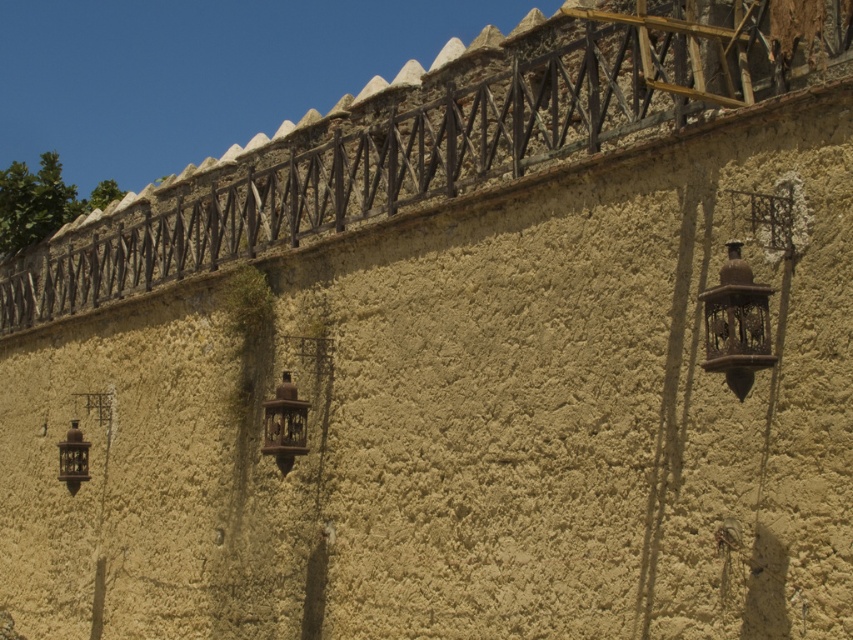
Question: Among these objects, which one is nearest to the camera?

Choices:
 (A) matte bronze lantern at lower left
 (B) antique brass lantern at right
 (C) rusty metal lantern at center

Answer: (B)

Question: Is rusty metal lantern at center positioned at the back of matte bronze lantern at lower left?

Choices:
 (A) yes
 (B) no

Answer: (B)

Question: Is antique brass lantern at right wider than matte bronze lantern at lower left?

Choices:
 (A) yes
 (B) no

Answer: (A)

Question: Does antique brass lantern at right have a lesser width compared to rusty metal lantern at center?

Choices:
 (A) no
 (B) yes

Answer: (A)

Question: Among these points, which one is nearest to the camera?

Choices:
 (A) (61, 476)
 (B) (283, 433)

Answer: (B)

Question: Which of the following is the closest to the observer?

Choices:
 (A) antique brass lantern at right
 (B) rusty metal lantern at center
 (C) matte bronze lantern at lower left

Answer: (A)